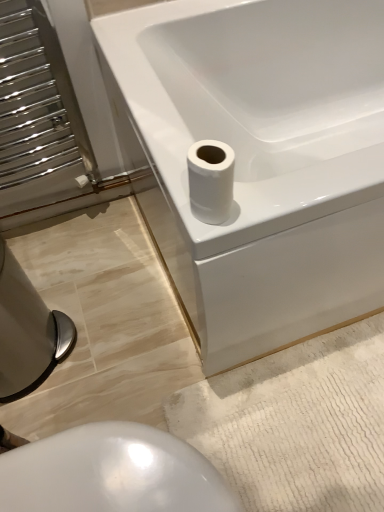
Where is `vacant area on the back side of brushed metal bidet at lower left, which ranks as the first bidet in left-to-right order`? vacant area on the back side of brushed metal bidet at lower left, which ranks as the first bidet in left-to-right order is located at coordinates (65, 270).